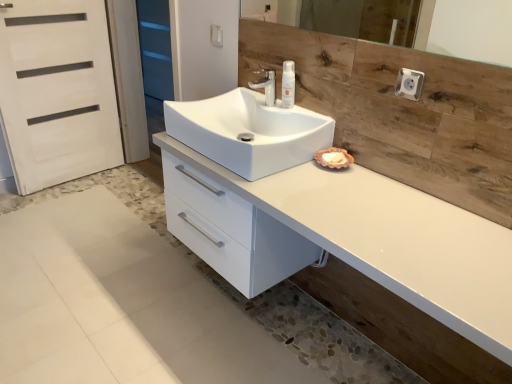
Locate an element on the screen. The height and width of the screenshot is (384, 512). vacant area situated below white matte door at left, the first screen door positioned from the bottom (from a real-world perspective) is located at coordinates (80, 177).